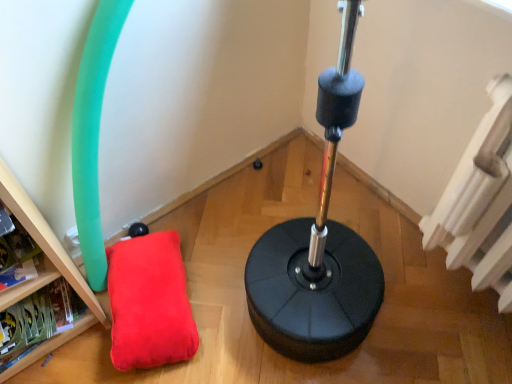
Identify the location of white textured radiator at upper right. This screenshot has width=512, height=384. (480, 202).

Identify the location of wooden bookshelf at lower left. This screenshot has width=512, height=384. (47, 269).

The width and height of the screenshot is (512, 384). What are the coordinates of `white textured radiator at upper right` in the screenshot? It's located at (480, 202).

From the image's perspective, is white textured radiator at upper right located above or below wooden bookshelf at lower left?

From the image's perspective, white textured radiator at upper right appears above wooden bookshelf at lower left.

Is white textured radiator at upper right thinner than wooden bookshelf at lower left?

Correct, the width of white textured radiator at upper right is less than that of wooden bookshelf at lower left.

Considering the sizes of objects white textured radiator at upper right and wooden bookshelf at lower left in the image provided, who is bigger, white textured radiator at upper right or wooden bookshelf at lower left?

white textured radiator at upper right.

Is white textured radiator at upper right aimed at wooden bookshelf at lower left?

No, white textured radiator at upper right is not facing towards wooden bookshelf at lower left.

Does velvet red pillow at lower left have a lesser height compared to white textured radiator at upper right?

Yes.

From the picture: How different are the orientations of velvet red pillow at lower left and white textured radiator at upper right in degrees?

The angular difference between velvet red pillow at lower left and white textured radiator at upper right is 115 degrees.

In order to click on radiator that appears on the right of velvet red pillow at lower left in this screenshot , I will do `click(480, 202)`.

From the image's perspective, is wooden bookshelf at lower left on top of white textured radiator at upper right?

Incorrect, from the image's perspective, wooden bookshelf at lower left is lower than white textured radiator at upper right.

Is wooden bookshelf at lower left thinner than white textured radiator at upper right?

No, wooden bookshelf at lower left is not thinner than white textured radiator at upper right.

Is wooden bookshelf at lower left looking in the opposite direction of white textured radiator at upper right?

wooden bookshelf at lower left does not have its back to white textured radiator at upper right.

Which is nearer, (3, 184) or (510, 101)?

Point (510, 101)

From the image's perspective, is wooden bookshelf at lower left located beneath velvet red pillow at lower left?

No.

In the scene shown: Does wooden bookshelf at lower left come behind velvet red pillow at lower left?

That is False.

Is wooden bookshelf at lower left aimed at velvet red pillow at lower left?

No.

Can you confirm if wooden bookshelf at lower left is positioned to the right of velvet red pillow at lower left?

No, wooden bookshelf at lower left is not to the right of velvet red pillow at lower left.

From the image's perspective, is white textured radiator at upper right on velvet red pillow at lower left?

Yes, from the image's perspective, white textured radiator at upper right is above velvet red pillow at lower left.

Is white textured radiator at upper right positioned with its back to velvet red pillow at lower left?

No, velvet red pillow at lower left is not at the back of white textured radiator at upper right.

Is white textured radiator at upper right closer to the viewer compared to velvet red pillow at lower left?

Yes, it is.

Between white textured radiator at upper right and velvet red pillow at lower left, which one has less height?

velvet red pillow at lower left is shorter.

Can you confirm if velvet red pillow at lower left is smaller than wooden bookshelf at lower left?

No.

Looking at this image, what's the angular difference between velvet red pillow at lower left and wooden bookshelf at lower left's facing directions?

156 degrees.

Would you say velvet red pillow at lower left contains wooden bookshelf at lower left?

No, wooden bookshelf at lower left is not surrounded by velvet red pillow at lower left.

From a real-world perspective, which is physically below, velvet red pillow at lower left or wooden bookshelf at lower left?

velvet red pillow at lower left is physically lower.

Where is `furniture behind the white textured radiator at upper right`? Image resolution: width=512 pixels, height=384 pixels. furniture behind the white textured radiator at upper right is located at coordinates (47, 269).

This screenshot has height=384, width=512. I want to click on radiator above the velvet red pillow at lower left (from a real-world perspective), so click(480, 202).

Looking at the image, which one is located further to white textured radiator at upper right, velvet red pillow at lower left or wooden bookshelf at lower left?

The object further to white textured radiator at upper right is wooden bookshelf at lower left.

Considering their positions, is white textured radiator at upper right positioned further to wooden bookshelf at lower left than velvet red pillow at lower left?

white textured radiator at upper right is positioned further to the anchor wooden bookshelf at lower left.

Looking at the image, which one is located further to velvet red pillow at lower left, white textured radiator at upper right or wooden bookshelf at lower left?

The object further to velvet red pillow at lower left is white textured radiator at upper right.

Estimate the real-world distances between objects in this image. Which object is closer to velvet red pillow at lower left, wooden bookshelf at lower left or white textured radiator at upper right?

wooden bookshelf at lower left.

From the image, which object appears to be nearer to wooden bookshelf at lower left, velvet red pillow at lower left or white textured radiator at upper right?

Among the two, velvet red pillow at lower left is located nearer to wooden bookshelf at lower left.

When comparing their distances from white textured radiator at upper right, does wooden bookshelf at lower left or velvet red pillow at lower left seem further?

wooden bookshelf at lower left lies further to white textured radiator at upper right than the other object.

Where is `pillow between wooden bookshelf at lower left and white textured radiator at upper right`? The width and height of the screenshot is (512, 384). pillow between wooden bookshelf at lower left and white textured radiator at upper right is located at coordinates (149, 302).